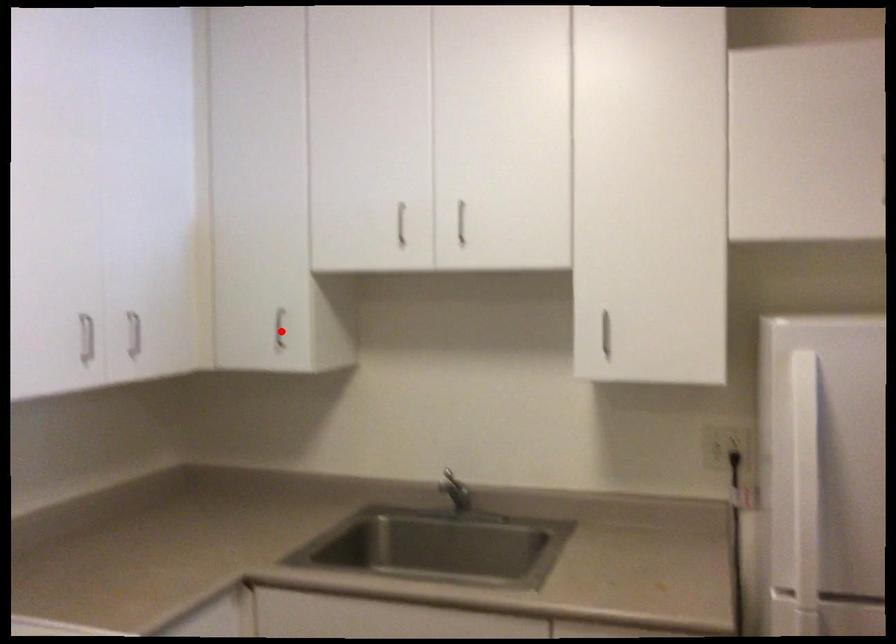
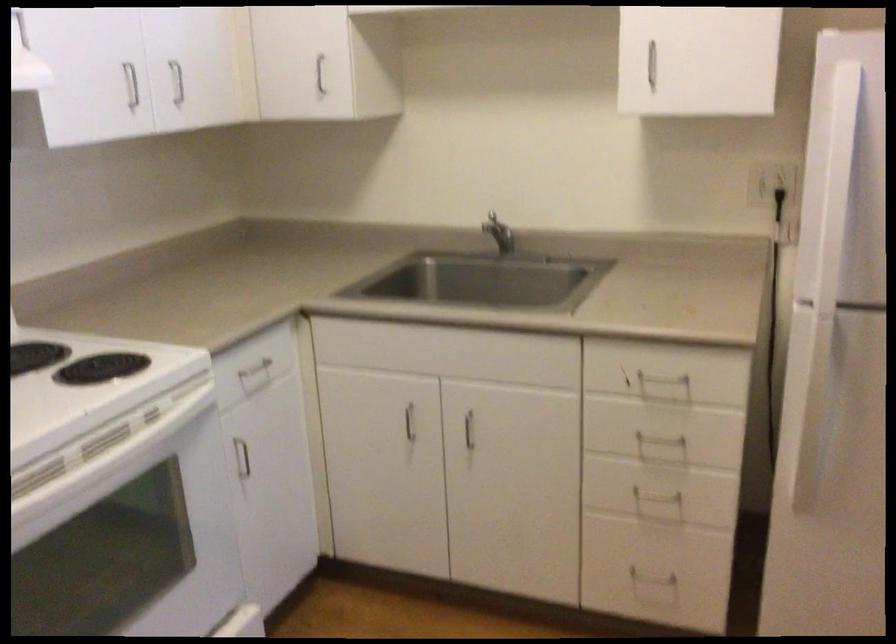
Where in the second image is the point corresponding to the highlighted location from the first image?

(319, 75)